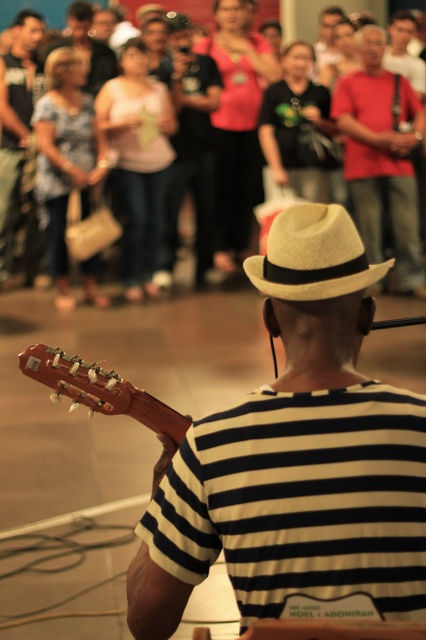
Question: Can you confirm if matte black shirt at upper left is positioned below matte black guitar at center?

Choices:
 (A) no
 (B) yes

Answer: (B)

Question: Which is farther from the woolen fedora at center?

Choices:
 (A) matte red shirt at upper right
 (B) matte black shirt at upper left

Answer: (B)

Question: From the image, what is the correct spatial relationship of matte red shirt at upper right in relation to light pink fabric at center?

Choices:
 (A) below
 (B) above

Answer: (B)

Question: Which point is closer to the camera taking this photo?

Choices:
 (A) (319, 120)
 (B) (354, 284)
 (C) (344, 362)

Answer: (B)

Question: Can you confirm if white straw hat at center is positioned to the left of matte red shirt at upper right?

Choices:
 (A) yes
 (B) no

Answer: (A)

Question: Which of these objects is positioned closest to the matte black shirt at upper left?

Choices:
 (A) white straw hat at center
 (B) woolen fedora at center

Answer: (A)